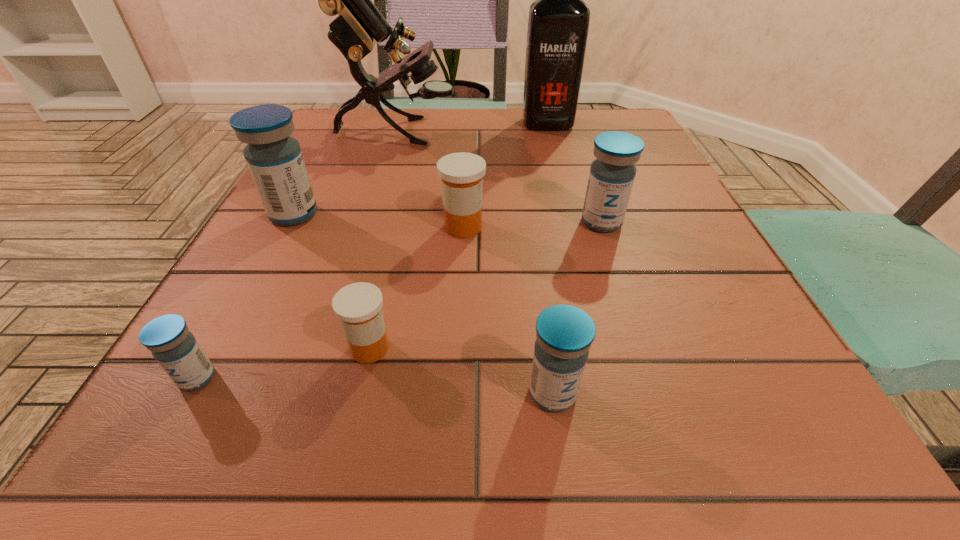
Where is `blue medicine object that ranks as the third closest to the third medicine from right to left`? blue medicine object that ranks as the third closest to the third medicine from right to left is located at coordinates (564, 334).

Locate an element on the screen. vacant space that satisfies the following two spatial constraints: 1. on the front-facing side of the black liquor; 2. on the label of the left orange medicine is located at coordinates (607, 348).

You are a GUI agent. You are given a task and a screenshot of the screen. Output one action in this format:
    pyautogui.click(x=<x>, y=<y>)
    Task: Click on the free spot that satisfies the following two spatial constraints: 1. on the front side of the second medicine from right to left; 2. on the right side of the smallest blue medicine
    Image resolution: width=960 pixels, height=540 pixels.
    Given the screenshot: What is the action you would take?
    pyautogui.click(x=189, y=393)

The image size is (960, 540). I want to click on free space in the image that satisfies the following two spatial constraints: 1. on the front-facing side of the liquor; 2. on the label of the farther orange medicine, so click(x=575, y=227).